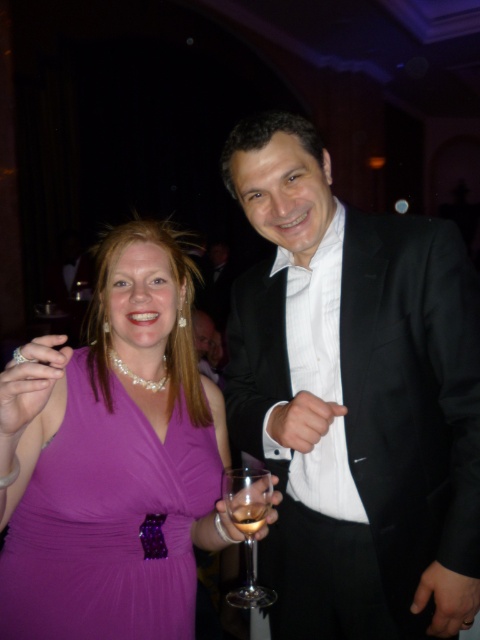
In the scene shown: You are a photographer at the event and need to position a spotlight on the black satin suit at right. According to the coordinates provided, where should you aim the spotlight?

The black satin suit at right is located at point [358,400], so aim the spotlight at those coordinates to illuminate it properly.

You are a photographer at the event and want to take a photo of the black satin suit at right without the clear glass wine glass at center appearing in the shot. Is this possible?

The clear glass wine glass at center is behind the black satin suit at right, so it will not be visible in the photo if the photographer focuses on the black satin suit at right.